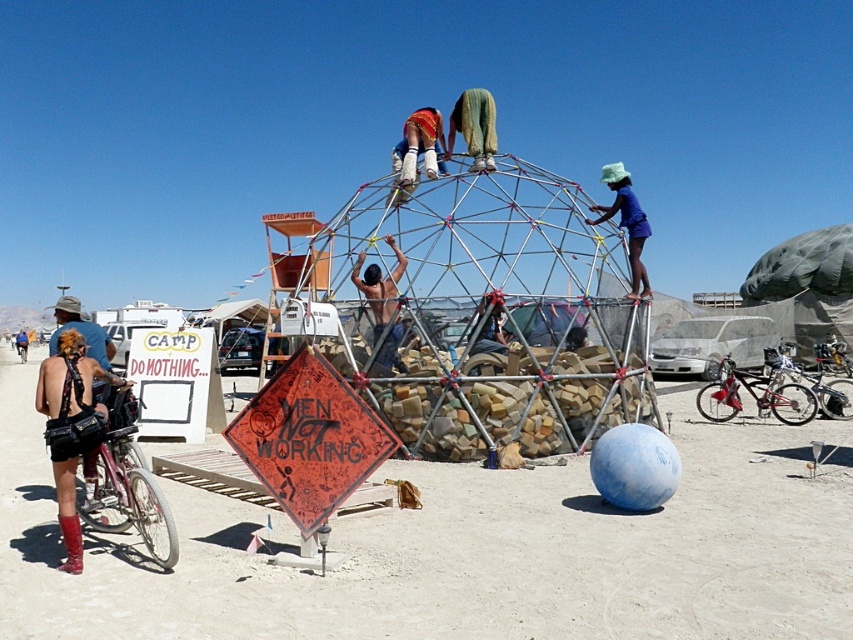
Consider the image. You are a participant at the desert festival and want to place a 3.5 meter long decorative banner between the orange reflective diamond at center and the shiny metallic pole at center. Can you fit the banner between them without overlapping either object?

The distance between the orange reflective diamond at center and the shiny metallic pole at center is 4.22 meters. Since the banner is 3.5 meters long, it can fit between them without overlapping either object as there is enough space.

You are a photographer at the desert festival and want to capture both the leather black purse at lower left and the silver metallic bicycle at lower right in a single shot. Which object should you focus on first to ensure both are in frame?

The leather black purse at lower left is positioned over the silver metallic bicycle at lower right, so focusing on the purse first will ensure the bicycle is visible beneath it in the frame.

Based on the scene description, what object is located at the coordinates point [309,438]?

The orange reflective diamond at center is located at point [309,438].